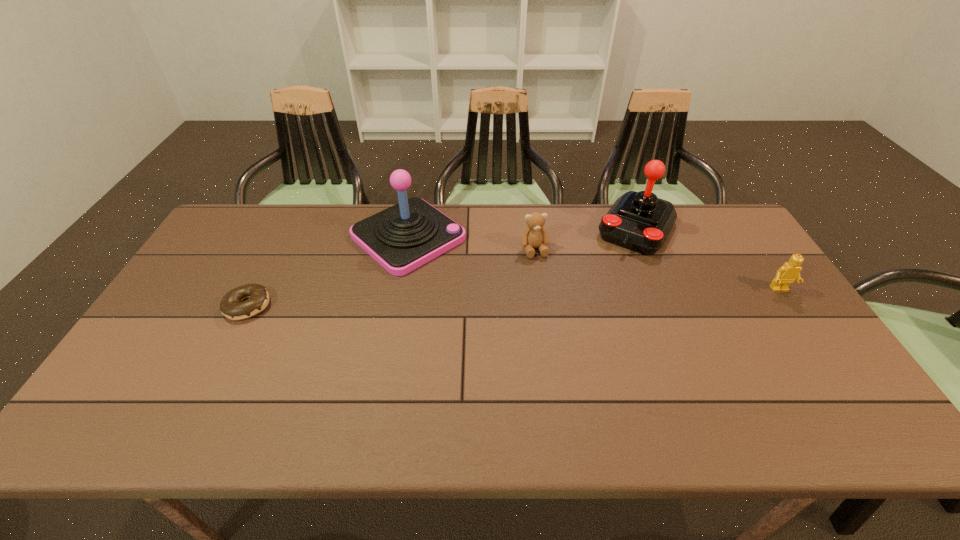
Identify the location of vacant space situated 0.390m on the face of the third object from right to left. The height and width of the screenshot is (540, 960). (571, 362).

Locate an element on the screen. free region located forward from the base of the left joystick is located at coordinates (514, 320).

You are a GUI agent. You are given a task and a screenshot of the screen. Output one action in this format:
    pyautogui.click(x=<x>, y=<y>)
    Task: Click on the free space located forward from the base of the left joystick
    Image resolution: width=960 pixels, height=540 pixels.
    Given the screenshot: What is the action you would take?
    pyautogui.click(x=521, y=327)

Find the location of `free space located forward from the base of the left joystick`. free space located forward from the base of the left joystick is located at coordinates (524, 329).

Identify the location of free space located on the base of the right joystick. This screenshot has height=540, width=960. (615, 266).

Locate an element on the screen. The width and height of the screenshot is (960, 540). free point located 0.130m on the base of the right joystick is located at coordinates (608, 277).

The image size is (960, 540). What are the coordinates of `vacant space positioned on the base of the right joystick` in the screenshot? It's located at (591, 304).

At what (x,y) coordinates should I click in order to perform the action: click on teddy bear located at the far edge. Please return your answer as a coordinate pair (x, y). The width and height of the screenshot is (960, 540). Looking at the image, I should click on (534, 236).

The image size is (960, 540). I want to click on object at the left edge, so click(231, 306).

Where is `object positioned at the right edge`? The width and height of the screenshot is (960, 540). object positioned at the right edge is located at coordinates (790, 271).